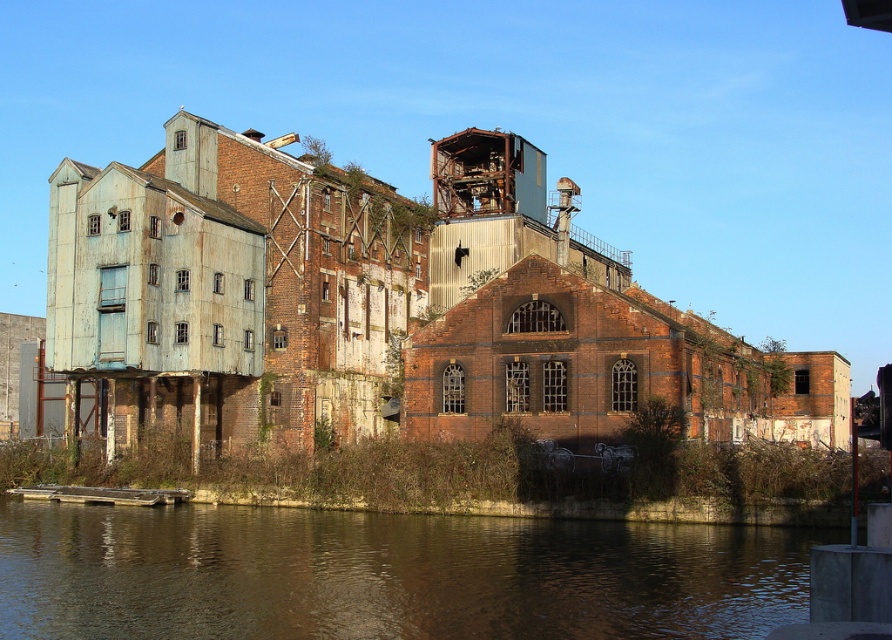
Question: Does rusty metal building at left appear under brown reflective water at lower left?

Choices:
 (A) no
 (B) yes

Answer: (A)

Question: Is rusty metal building at left bigger than brown reflective water at lower left?

Choices:
 (A) yes
 (B) no

Answer: (A)

Question: Where is rusty metal building at left located in relation to brown reflective water at lower left in the image?

Choices:
 (A) below
 (B) above

Answer: (B)

Question: Which point is farther to the camera?

Choices:
 (A) (581, 628)
 (B) (494, 385)

Answer: (B)

Question: Which point is closer to the camera?

Choices:
 (A) (446, 266)
 (B) (37, 557)

Answer: (B)